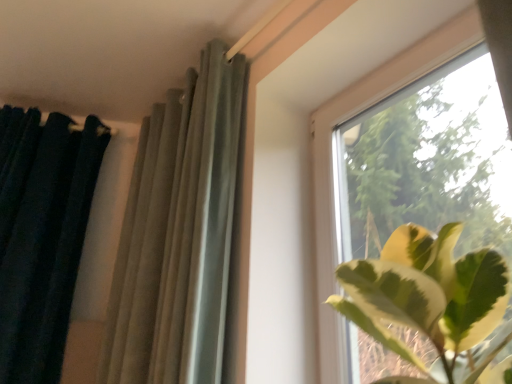
Question: Is dark green velvet curtain at left, which is counted as the first curtain, starting from the left, wider or thinner than transparent glass window at upper right?

Choices:
 (A) thin
 (B) wide

Answer: (B)

Question: From the image's perspective, relative to transparent glass window at upper right, is dark green velvet curtain at left, positioned as the 2th curtain in right-to-left order, above or below?

Choices:
 (A) above
 (B) below

Answer: (B)

Question: Which of these objects is positioned farthest from the transparent glass window at upper right?

Choices:
 (A) satin gray curtain at upper center, which ranks as the first curtain in right-to-left order
 (B) dark green velvet curtain at left, positioned as the 2th curtain in right-to-left order

Answer: (B)

Question: Based on their relative distances, which object is farther from the satin gray curtain at upper center, which ranks as the first curtain in right-to-left order?

Choices:
 (A) dark green velvet curtain at left, positioned as the 2th curtain in right-to-left order
 (B) transparent glass window at upper right

Answer: (A)